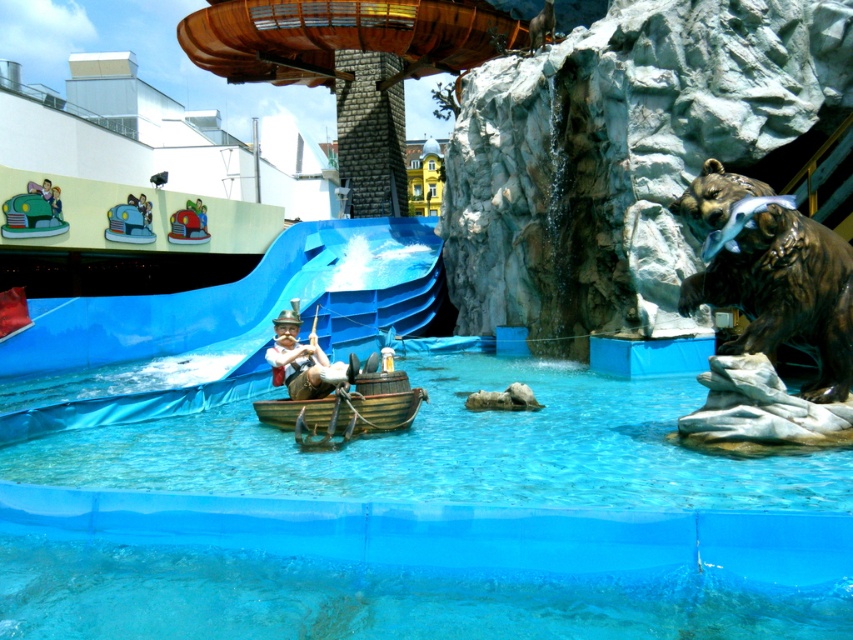
Can you confirm if bronze bear at right is taller than wooden raft at center?

Indeed, bronze bear at right has a greater height compared to wooden raft at center.

Is the position of bronze bear at right less distant than that of wooden raft at center?

Yes, bronze bear at right is in front of wooden raft at center.

Is point (715, 280) closer to camera compared to point (286, 401)?

Yes, point (715, 280) is in front of point (286, 401).

Find the location of a particular element. bronze bear at right is located at coordinates (785, 292).

Does wooden raft at center have a smaller size compared to metallic red car at upper left?

Correct, wooden raft at center occupies less space than metallic red car at upper left.

Who is more forward, (316,406) or (204,230)?

Positioned in front is point (316,406).

I want to click on wooden raft at center, so click(343, 412).

Is transparent plastic pool at center above wooden raft at center?

Incorrect, transparent plastic pool at center is not positioned above wooden raft at center.

Can you confirm if transparent plastic pool at center is taller than wooden raft at center?

Correct, transparent plastic pool at center is much taller as wooden raft at center.

The width and height of the screenshot is (853, 640). Describe the element at coordinates (426, 522) in the screenshot. I see `transparent plastic pool at center` at that location.

Where is `transparent plastic pool at center`? This screenshot has width=853, height=640. transparent plastic pool at center is located at coordinates (426, 522).